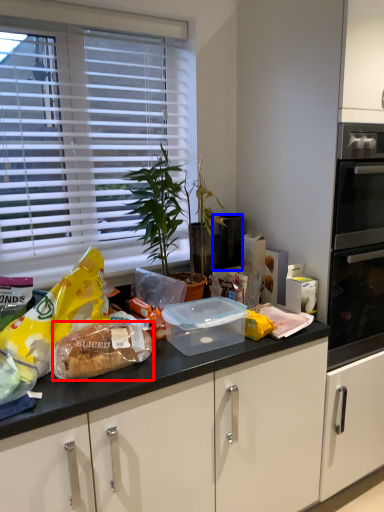
Question: Which point is closer to the camera, food (highlighted by a red box) or appliance (highlighted by a blue box)?

Choices:
 (A) food
 (B) appliance

Answer: (A)